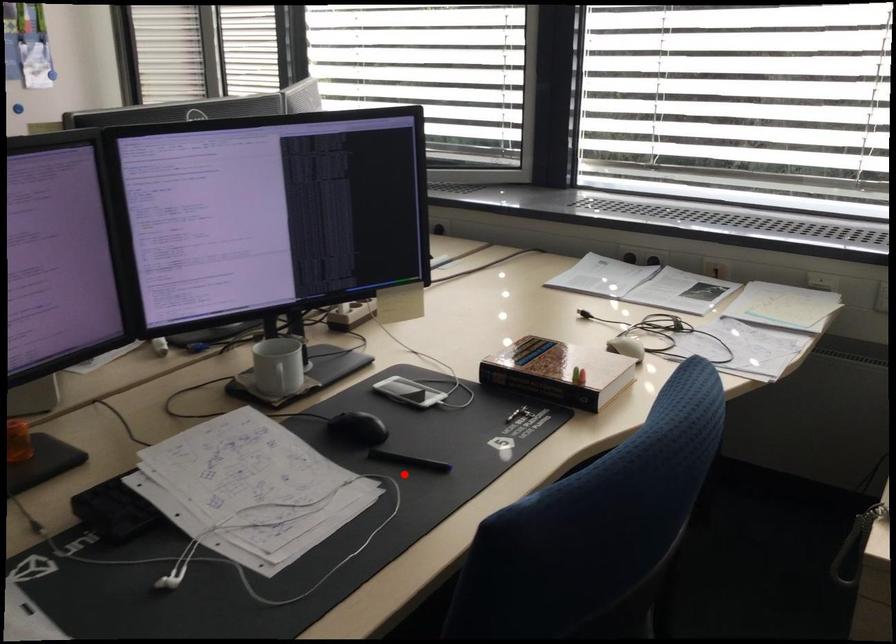
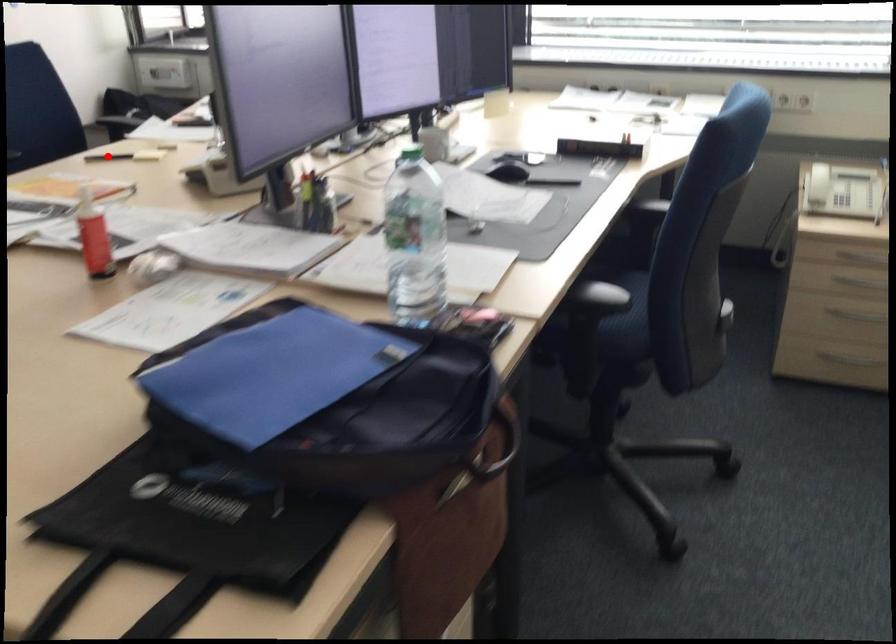
I am providing you with two images of the same scene from different viewpoints. A red point is marked on the first image and another point is marked on the second image. Is the marked point in image1 the same physical position as the marked point in image2?

No